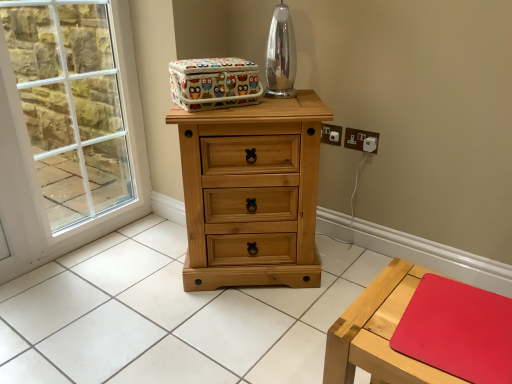
Locate an element on the screen. Image resolution: width=512 pixels, height=384 pixels. empty space that is to the right of natural wood chest of drawers at center is located at coordinates (343, 266).